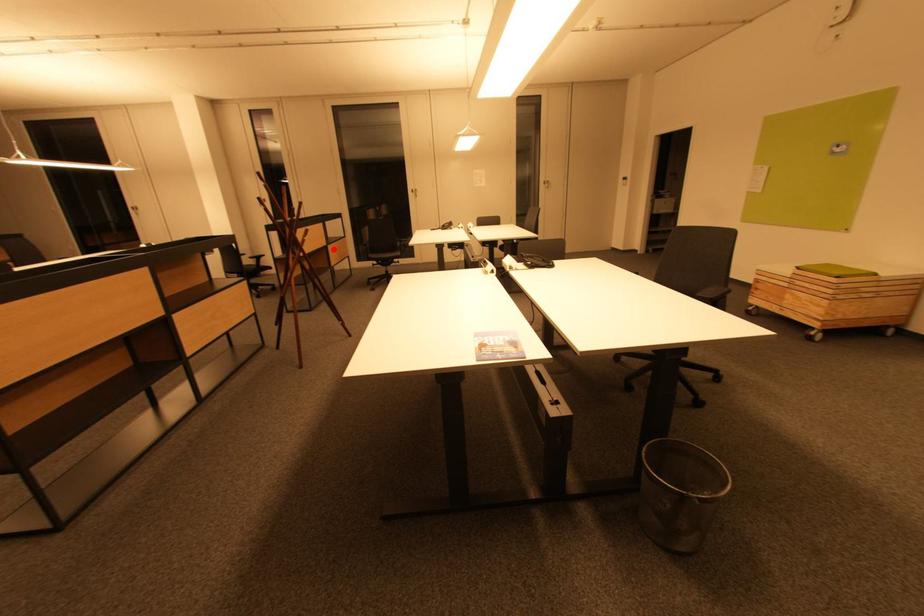
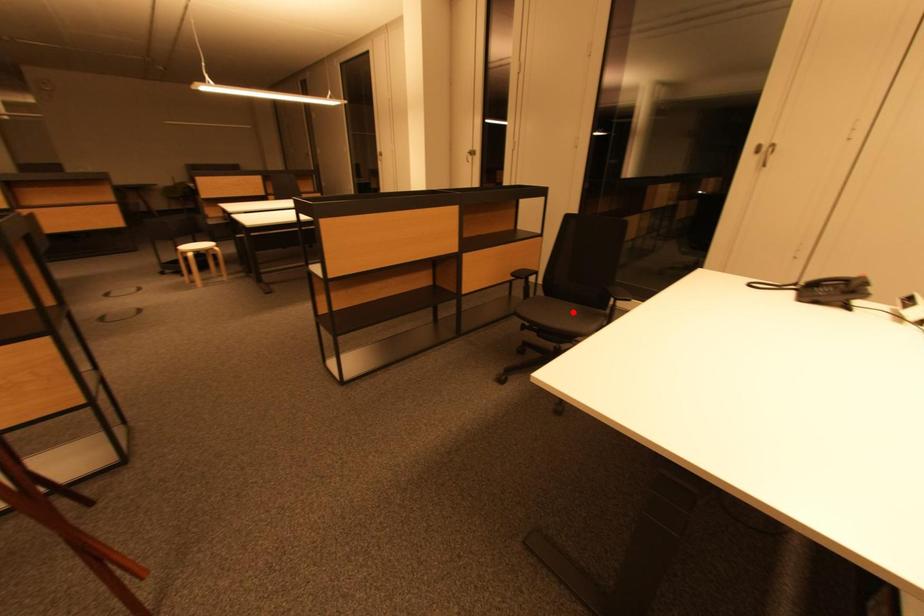
I am providing you with two images of the same scene from different viewpoints. A red point is marked on the first image and another point is marked on the second image. Do the highlighted points in image1 and image2 indicate the same real-world spot?

No